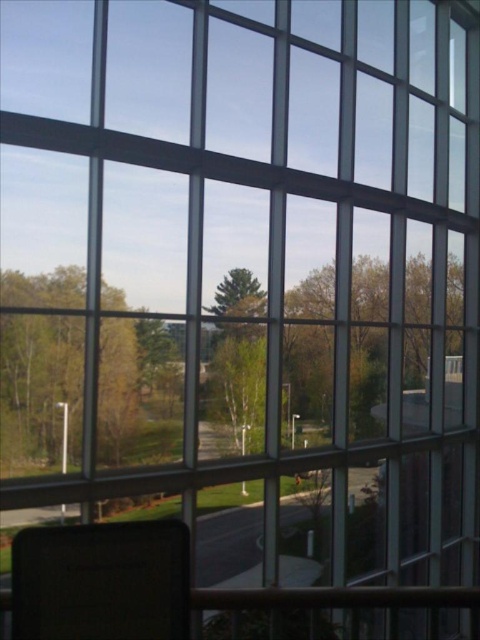
You are sitting on the matte black chair at lower left and want to look at the green matte tree at center through the window. Can you see the entire tree without moving your head?

The matte black chair at lower left is in front of the green matte tree at center, so you might not be able to see the entire tree without moving your head because the chair is blocking part of the view.

You are standing in a room with a large window and want to place a small potted plant between the matte black chair at lower left and the green matte tree at center. Can the potted plant fit between them if it requires 1 meter of space?

The matte black chair at lower left has a lesser width compared to green matte tree at center. However, the exact distance between them isn not specified in the objects description. Therefore, it is unclear if the potted plant requiring 1 meter of space can fit between them based on the provided information.

Looking at this image, you are standing in a room and looking through the window. You see a matte black chair at lower left and a green matte tree at center. Which object is positioned to the right of the other?

The matte black chair at lower left is to the right of the green matte tree at center.